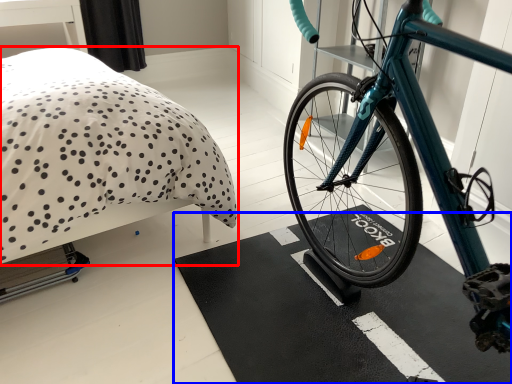
Question: Among these objects, which one is farthest to the camera, bed (highlighted by a red box) or bath mat (highlighted by a blue box)?

Choices:
 (A) bed
 (B) bath mat

Answer: (B)